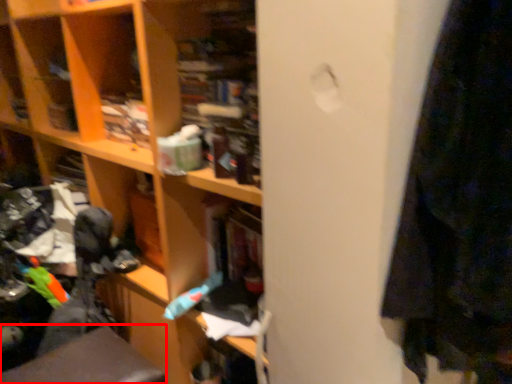
Question: Where is swivel chair (annotated by the red box) located in relation to toy in the image?

Choices:
 (A) right
 (B) left

Answer: (B)